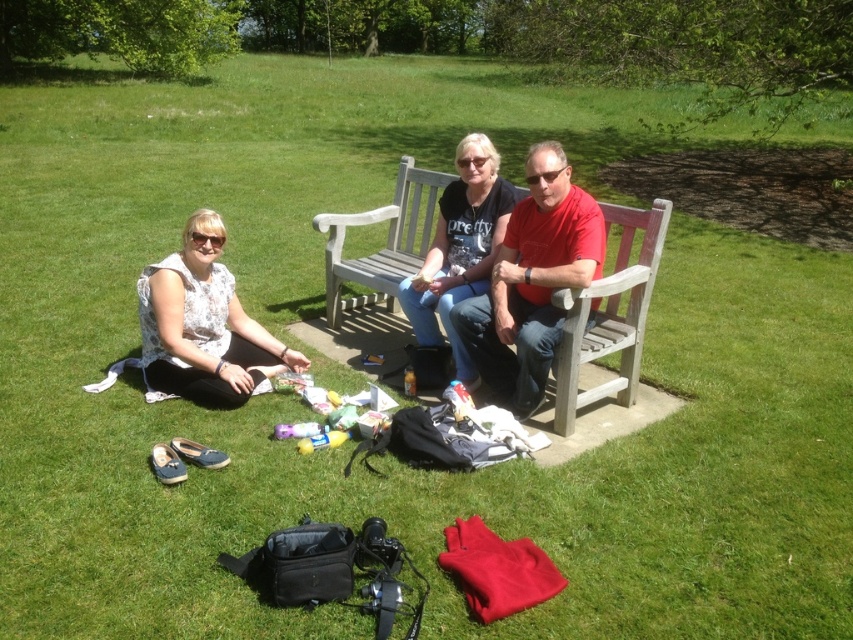
Is wooden park bench at center to the left of red matte shirt at center from the viewer's perspective?

Yes, wooden park bench at center is to the left of red matte shirt at center.

What do you see at coordinates (608, 317) in the screenshot? I see `wooden park bench at center` at bounding box center [608, 317].

Where is `wooden park bench at center`? This screenshot has height=640, width=853. wooden park bench at center is located at coordinates (608, 317).

Is red matte shirt at center to the right of matte black t-shirt at center from the viewer's perspective?

Yes, red matte shirt at center is to the right of matte black t-shirt at center.

From the picture: Who is positioned more to the right, red matte shirt at center or matte black t-shirt at center?

red matte shirt at center is more to the right.

In order to click on red matte shirt at center in this screenshot , I will do `click(532, 280)`.

Can you confirm if white floral dress at lower left is taller than matte black t-shirt at center?

No, white floral dress at lower left is not taller than matte black t-shirt at center.

Between point (148, 275) and point (495, 196), which one is positioned behind?

Positioned behind is point (495, 196).

The image size is (853, 640). Identify the location of white floral dress at lower left. (202, 324).